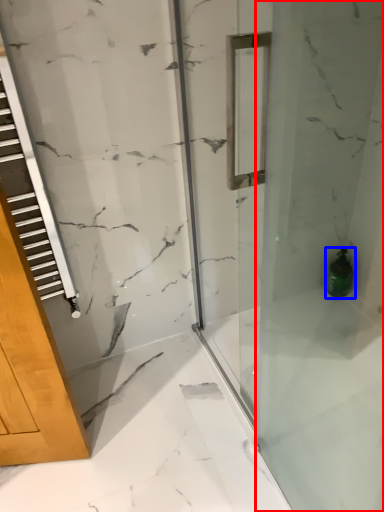
Question: Among these objects, which one is nearest to the camera, shower door (highlighted by a red box) or bottle (highlighted by a blue box)?

Choices:
 (A) shower door
 (B) bottle

Answer: (A)